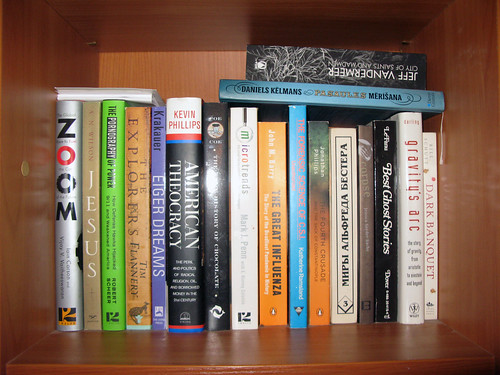
In order to click on white books in this screenshot , I will do `click(241, 225)`, `click(413, 225)`, `click(435, 219)`, `click(347, 226)`.